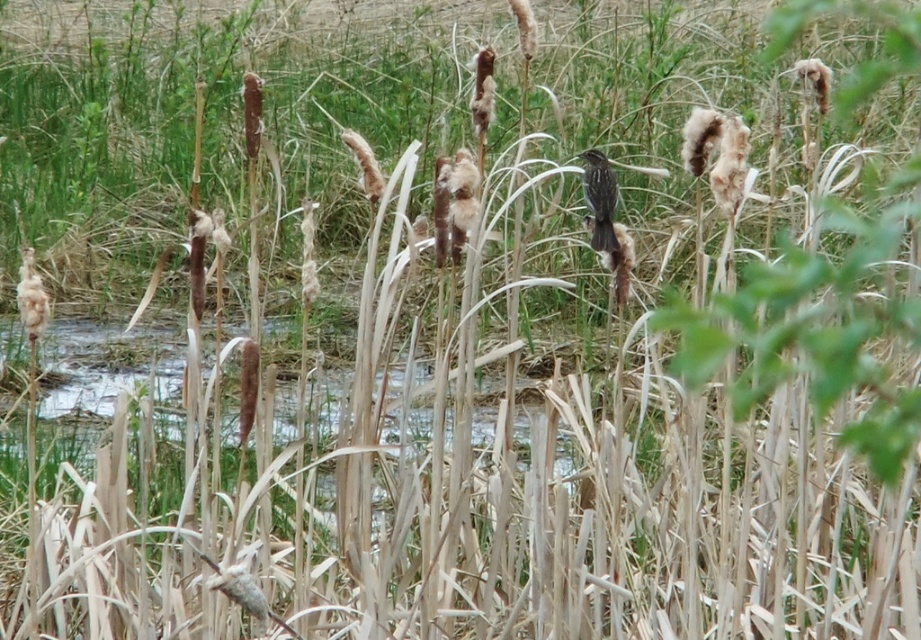
You are standing in a wetland area and spot a brown speckled bird at center. If you want to take a photo of it without disturbing the bird, which is sensitive to movement beyond 5 meters, should you stay where you are or move closer?

The brown speckled bird at center is 5.44 meters away from viewer. Since the bird is sensitive to movement beyond 5 meters, you should stay where you are to avoid disturbing it.

You are a nature photographer aiming to capture the brown speckled bird at center and the fuzzy brown reed at left in the same frame. Based on their positions, which object is closer to the left edge of the image?

The fuzzy brown reed at left is closer to the left edge of the image because the brown speckled bird at center is to the right of it.

You are a birdwatcher standing in the wetland and see the brown speckled bird at center and the fuzzy brown reed at left. Which object is closer to you?

The brown speckled bird at center is closer to you since it is only 8.68 feet away from the fuzzy brown reed at left, but without knowing the distance from the observer, we can only compare their relative positions. However, based on typical scene layouts, the bird at center is likely closer than the reed at left.